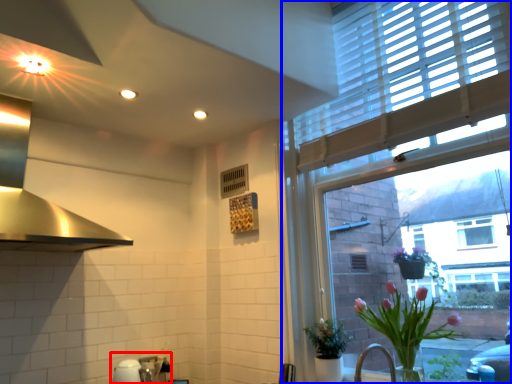
Question: Which object is closer to the camera taking this photo, sink (highlighted by a red box) or window (highlighted by a blue box)?

Choices:
 (A) sink
 (B) window

Answer: (B)